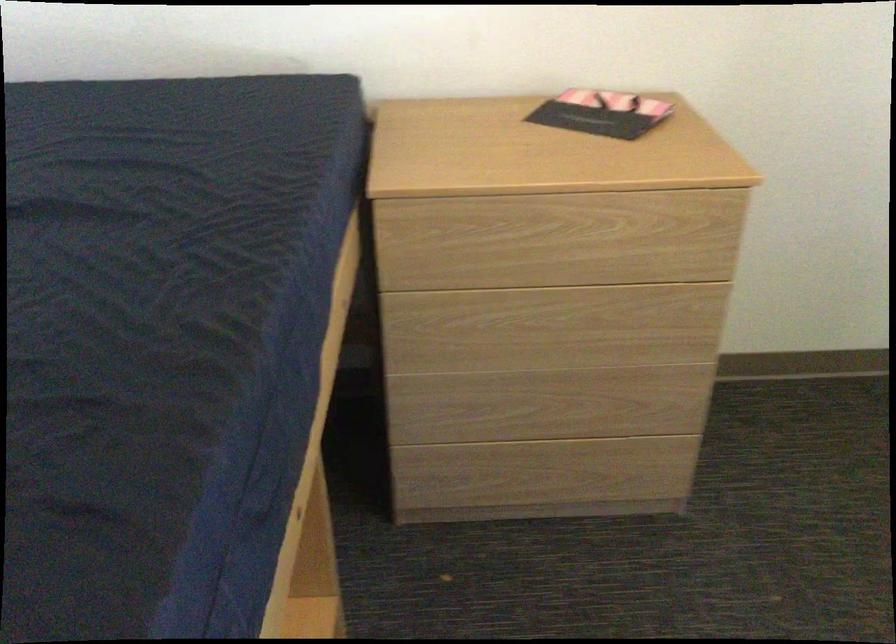
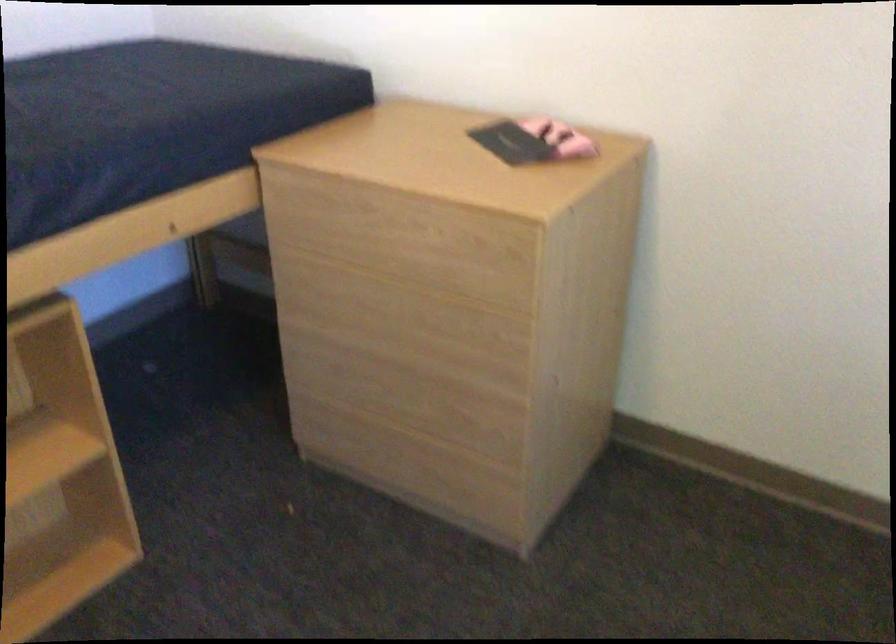
Find the pixel in the second image that matches pixel 624 433 in the first image.

(451, 440)